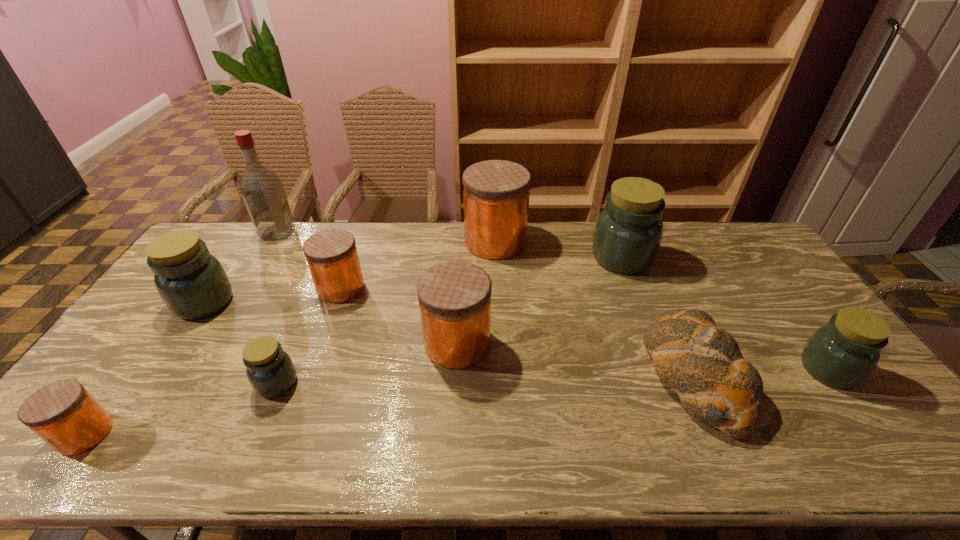
This screenshot has height=540, width=960. In order to click on the rightmost object in this screenshot , I will do `click(843, 353)`.

Locate an element on the screen. This screenshot has width=960, height=540. bread is located at coordinates (701, 362).

I want to click on the second green jar from left to right, so [270, 370].

Locate an element on the screen. the leftmost orange jar is located at coordinates (65, 415).

Where is `the nearest orange jar`? Image resolution: width=960 pixels, height=540 pixels. the nearest orange jar is located at coordinates (65, 415).

Locate an element on the screen. vacant space situated 0.250m on the front-facing side of the liquor is located at coordinates (360, 233).

Find the location of a particular element. vacant area located 0.120m on the back of the biggest green jar is located at coordinates (608, 221).

This screenshot has width=960, height=540. I want to click on free space located on the left of the biggest orange jar, so click(412, 241).

The height and width of the screenshot is (540, 960). I want to click on vacant area located 0.150m on the right of the second biggest orange jar, so click(543, 343).

At what (x,y) coordinates should I click in order to perform the action: click on free space located on the right of the second farthest green jar. Please return your answer as a coordinate pair (x, y). The width and height of the screenshot is (960, 540). Looking at the image, I should click on (249, 302).